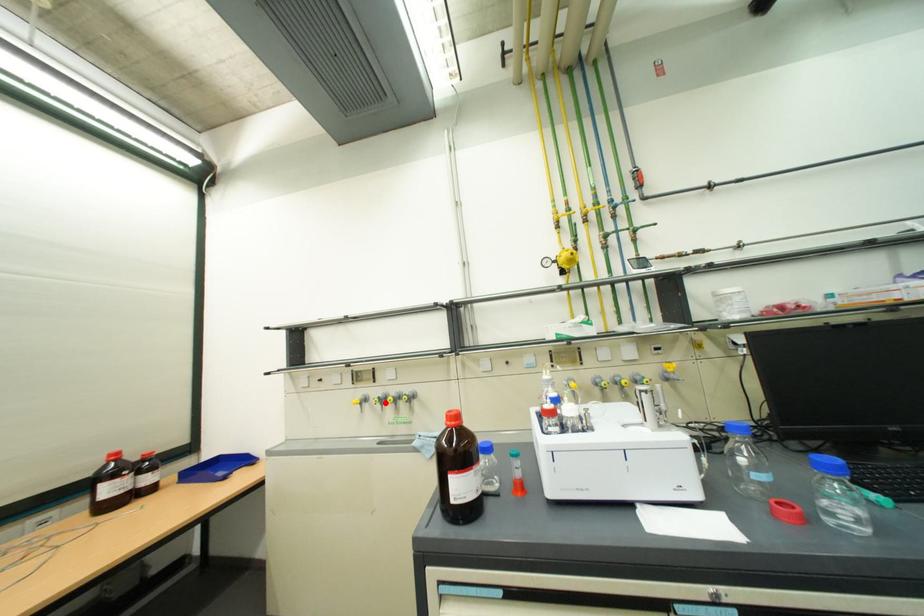
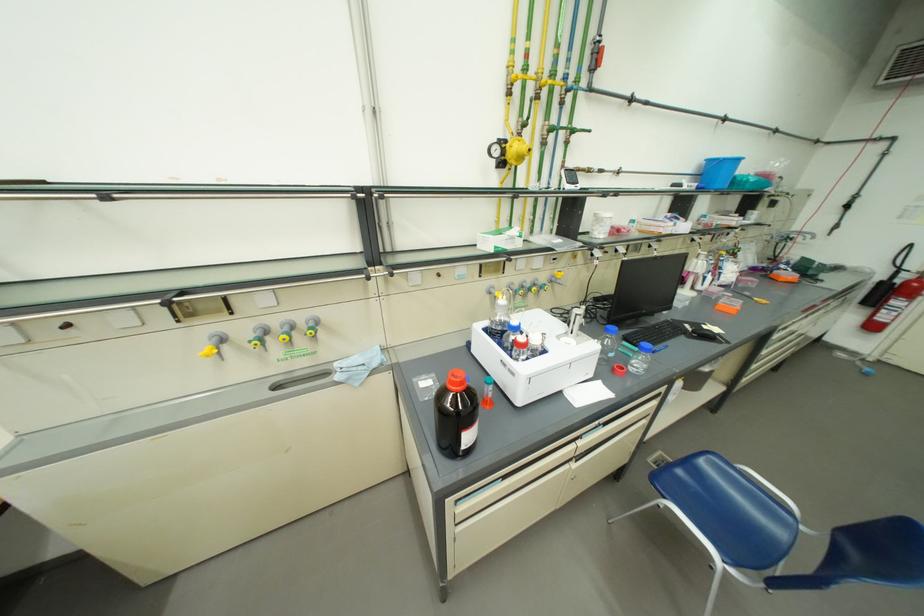
In the second image, find the point that corresponds to the highlighted location in the first image.

(265, 346)